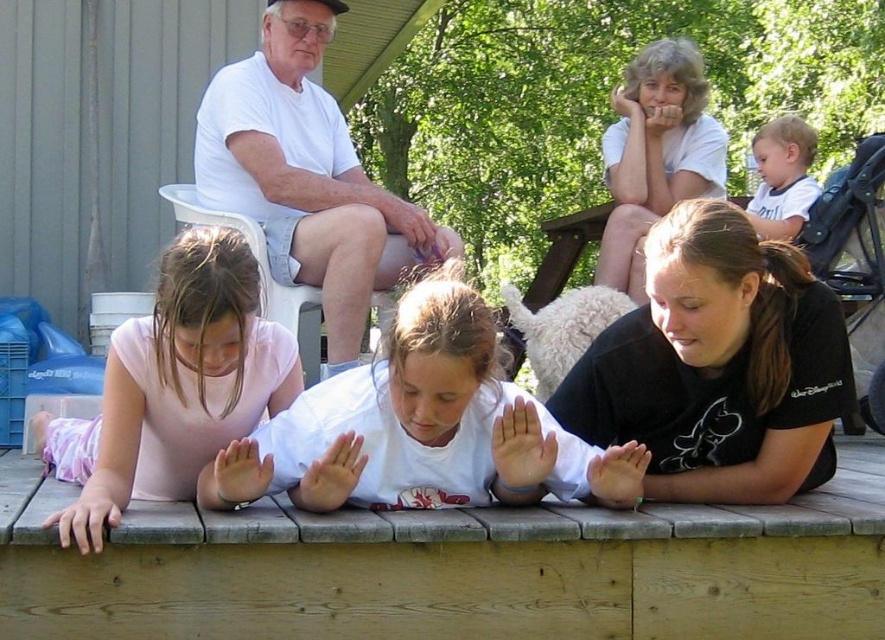
You are standing at the edge of the deck where the children are playing. You notice two points marked on the deck floor. The first point is at coordinates point (799, 474) and the second is at point (799, 147). If you want to reach the point that is closer to the children, which coordinate should you walk towards?

Point (799, 474) is in front of point (799, 147), so you should walk towards point (799, 474) to reach the one closer to the children.